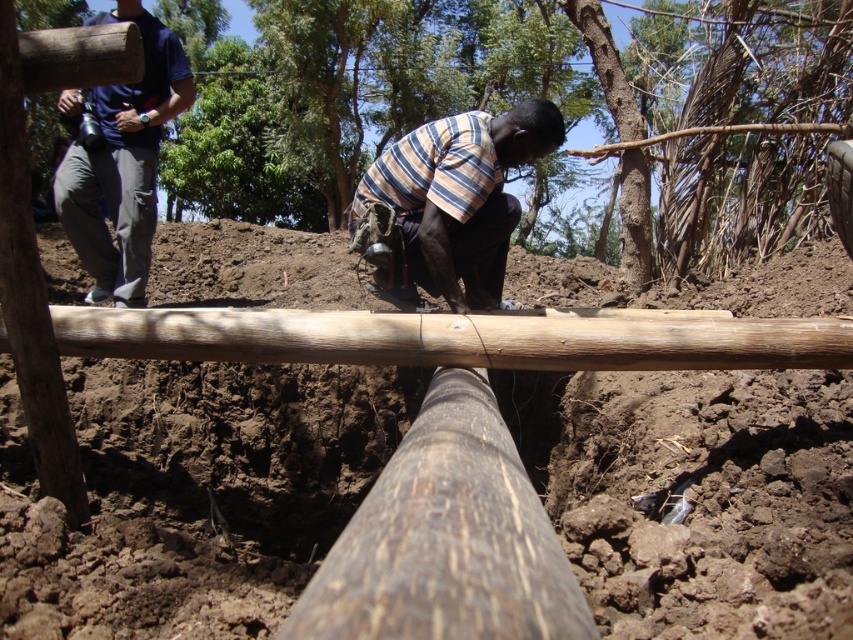
Can you confirm if brown wooden pole at center is bigger than blue cotton shirt at upper left?

Yes.

Does brown wooden pole at center appear on the right side of blue cotton shirt at upper left?

Yes, brown wooden pole at center is to the right of blue cotton shirt at upper left.

Describe the element at coordinates (515, 104) in the screenshot. This screenshot has height=640, width=853. I see `brown wooden pole at center` at that location.

Find the location of `brown wooden pole at center`. brown wooden pole at center is located at coordinates (515, 104).

Is striped cotton shirt at center smaller than blue cotton shirt at upper left?

Yes.

Who is taller, striped cotton shirt at center or blue cotton shirt at upper left?

Standing taller between the two is blue cotton shirt at upper left.

Between point (558, 132) and point (164, 106), which one is positioned behind?

The point (164, 106) is behind.

The image size is (853, 640). In order to click on striped cotton shirt at center in this screenshot , I will do `click(459, 196)`.

Between brown wooden pole at center and striped cotton shirt at center, which one has less height?

striped cotton shirt at center is shorter.

Does brown wooden pole at center have a larger size compared to striped cotton shirt at center?

Yes.

Is point (483, 61) closer to viewer compared to point (399, 221)?

No, it is behind (399, 221).

This screenshot has height=640, width=853. I want to click on brown wooden pole at center, so click(x=515, y=104).